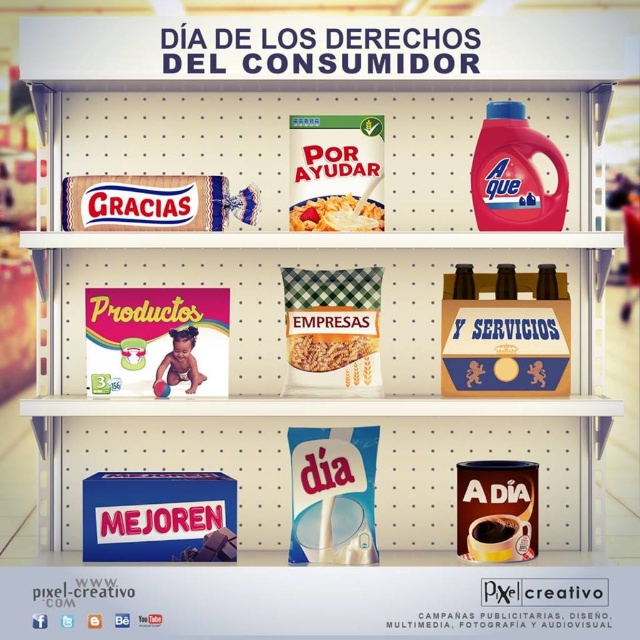
You are a customer looking at the top shelf in the store display. You see the green checkered fabric bag of cereal at center and the matte plastic cereal box at center. Which cereal package is lower on the shelf?

The green checkered fabric bag of cereal at center is positioned under the matte plastic cereal box at center, so the bag is lower than the box on the shelf.

You are a customer looking at the top shelf where the green checkered fabric bag of cereal at center and the matte plastic cereal box at center are displayed. Which cereal package is closer to you?

The green checkered fabric bag of cereal at center is closer to you than the matte plastic cereal box at center.

In the scene shown: In the image of the Consumer Rights Day display, there is a matte red cereal box at upper center and a decorative blue and white ribbon on the left. Which object is positioned to the right of the other?

The matte red cereal box at upper center is positioned to the right of the decorative blue and white ribbon on the left.